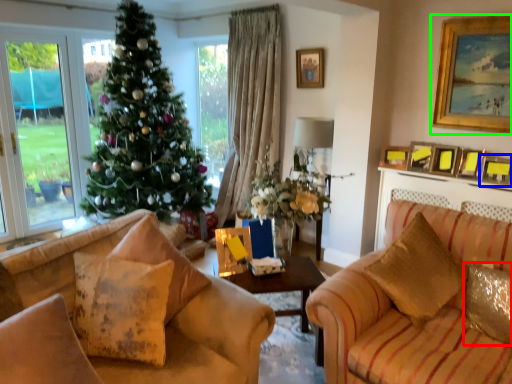
Question: Estimate the real-world distances between objects in this image. Which object is farther from pillow (highlighted by a red box), picture frame (highlighted by a blue box) or picture frame (highlighted by a green box)?

Choices:
 (A) picture frame
 (B) picture frame

Answer: (B)